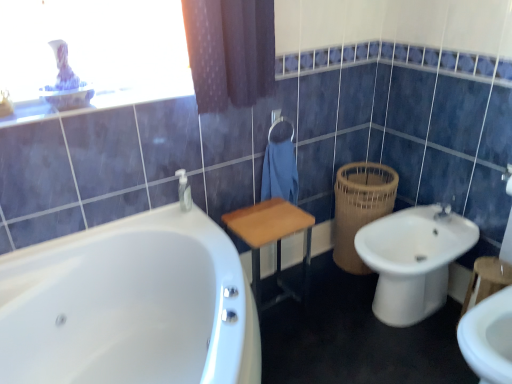
Question: From a real-world perspective, relative to white glossy bathtub at lower left, is woven brown basket at right vertically above or below?

Choices:
 (A) above
 (B) below

Answer: (B)

Question: In terms of width, does woven brown basket at right look wider or thinner when compared to white glossy bathtub at lower left?

Choices:
 (A) thin
 (B) wide

Answer: (A)

Question: Which object is positioned farthest from the woven brown basket at right?

Choices:
 (A) white glossy bathtub at lower left
 (B) translucent plastic soap dispenser at center
 (C) blue fabric towel at center
 (D) white ceramic bidet at lower right
 (E) wooden table at center

Answer: (A)

Question: Considering the real-world distances, which object is farthest from the blue fabric towel at center?

Choices:
 (A) translucent plastic soap dispenser at center
 (B) wooden table at center
 (C) woven brown basket at right
 (D) white ceramic bidet at lower right
 (E) white glossy bathtub at lower left

Answer: (E)